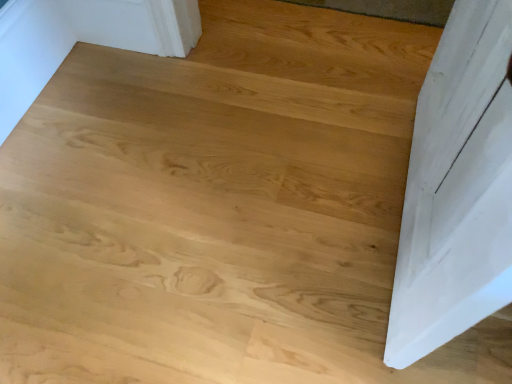
This screenshot has height=384, width=512. I want to click on white matte door at right, so click(457, 188).

What is the approximate height of white matte door at right?

white matte door at right is 34.45 inches tall.

Describe the element at coordinates (457, 188) in the screenshot. I see `white matte door at right` at that location.

What is the approximate width of white matte door at right?

white matte door at right is 3.26 inches in width.

Where is `white matte door at right`? The image size is (512, 384). white matte door at right is located at coordinates (457, 188).